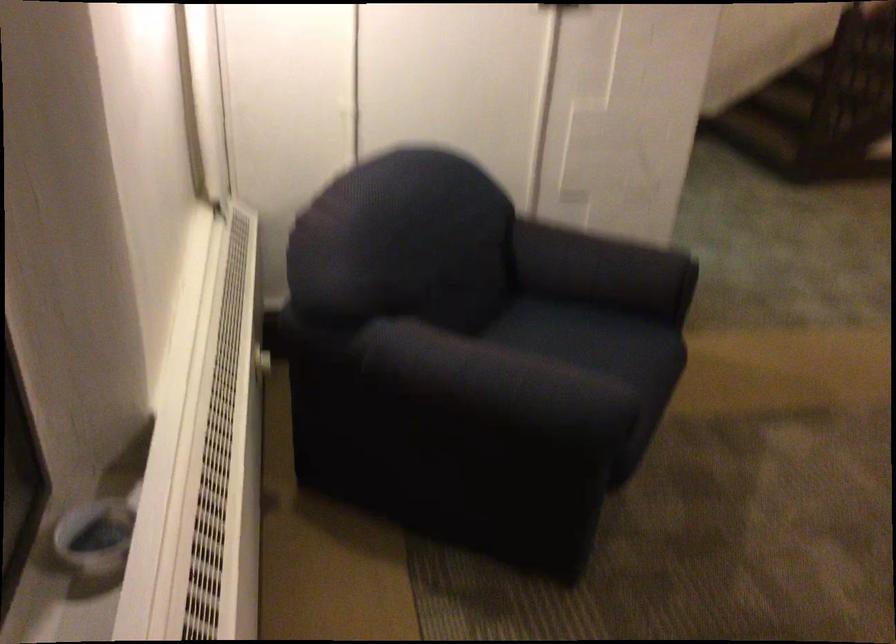
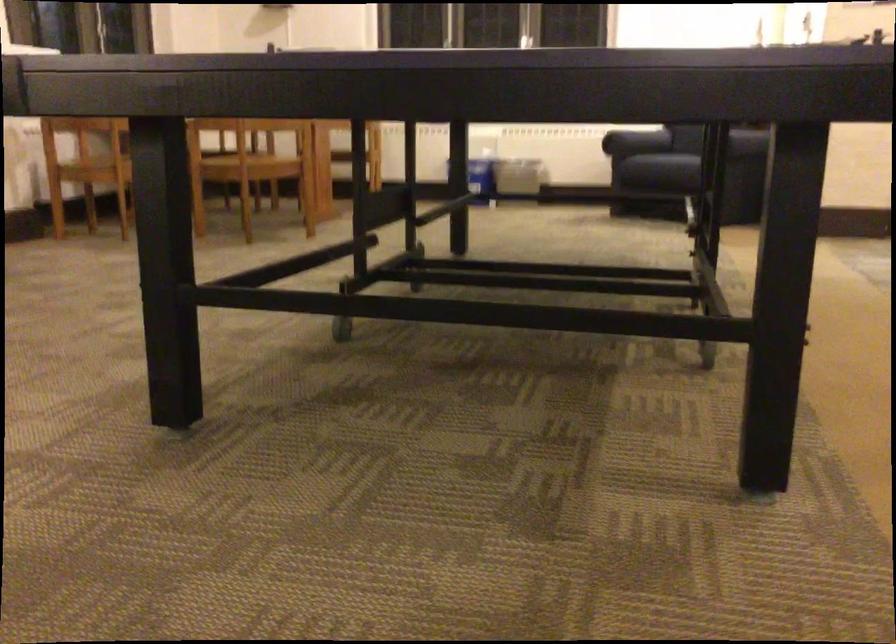
Question: I am providing you with two images of the same scene from different viewpoints. Please identify which objects are invisible in image2.

Choices:
 (A) pink bath sponge
 (B) chair sitting surface
 (C) dark blue armrest
 (D) sofa sitting surface

Answer: (C)